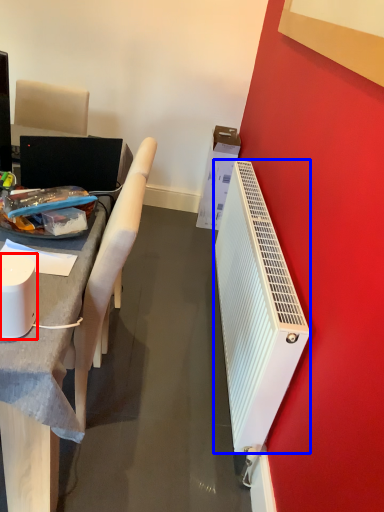
Question: Which object appears closest to the camera in this image, appliance (highlighted by a red box) or radiator (highlighted by a blue box)?

Choices:
 (A) appliance
 (B) radiator

Answer: (A)